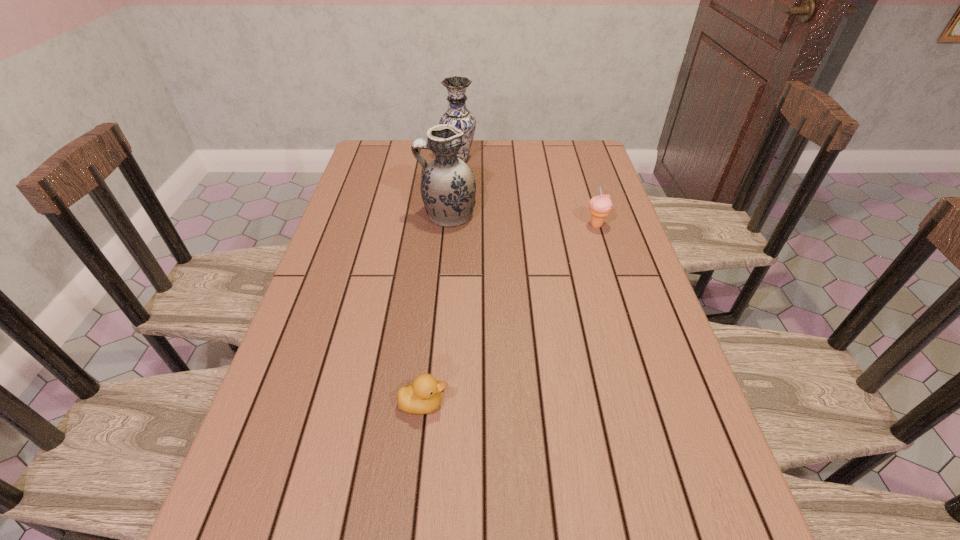
Find the location of a particular element. vacant space located 0.270m on the back of the icecream is located at coordinates (580, 172).

Identify the location of vacant space located on the face of the nearest object. (497, 403).

Image resolution: width=960 pixels, height=540 pixels. I want to click on object at the far edge, so click(457, 114).

Locate an element on the screen. object that is at the right edge is located at coordinates (600, 206).

Locate an element on the screen. Image resolution: width=960 pixels, height=540 pixels. blank space at the far edge of the desktop is located at coordinates (540, 160).

Locate an element on the screen. free space at the left edge of the desktop is located at coordinates (305, 355).

This screenshot has width=960, height=540. In the image, there is a desktop. Identify the location of vacant space at the right edge. point(695,438).

Locate an element on the screen. This screenshot has height=540, width=960. vacant region at the far left corner of the desktop is located at coordinates (386, 169).

Image resolution: width=960 pixels, height=540 pixels. In order to click on vacant point located between the rightmost object and the shortest object in this screenshot , I will do `click(510, 315)`.

Where is `unoccupied position between the icecream and the farthest object`? unoccupied position between the icecream and the farthest object is located at coordinates (528, 193).